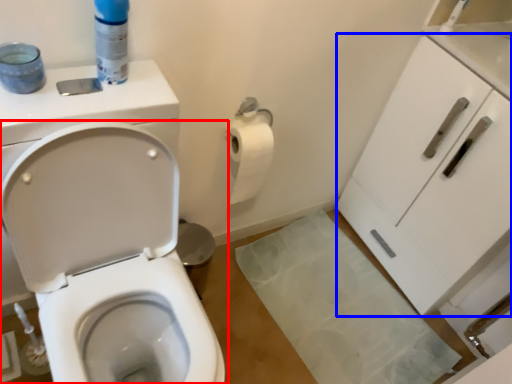
Question: Which of the following is the farthest to the observer, toilet (highlighted by a red box) or cabinetry (highlighted by a blue box)?

Choices:
 (A) toilet
 (B) cabinetry

Answer: (B)